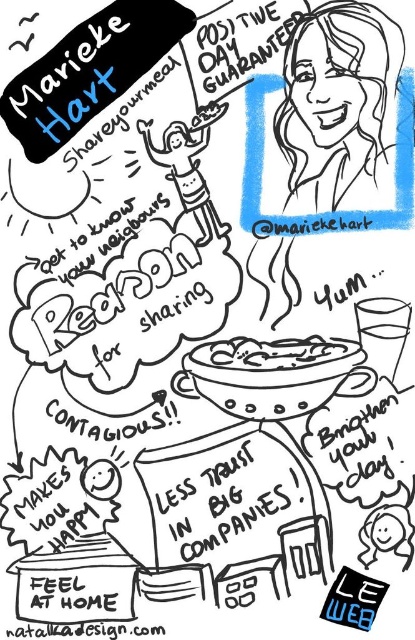
Question: Does sketchy hair at upper right come in front of white matte bowl at center?

Choices:
 (A) yes
 (B) no

Answer: (A)

Question: Which of the following is the closest to the observer?

Choices:
 (A) sketchy hair at upper right
 (B) white matte bowl at center

Answer: (A)

Question: From the image, what is the correct spatial relationship of sketchy hair at upper right in relation to white matte bowl at center?

Choices:
 (A) above
 (B) below

Answer: (A)

Question: Is sketchy hair at upper right to the left of white matte bowl at center from the viewer's perspective?

Choices:
 (A) yes
 (B) no

Answer: (B)

Question: Among these objects, which one is nearest to the camera?

Choices:
 (A) sketchy hair at upper right
 (B) white matte bowl at center

Answer: (A)